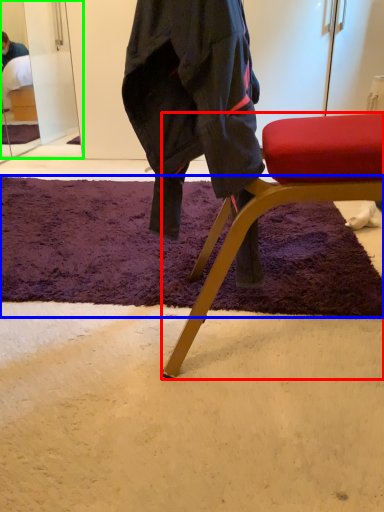
Question: Considering the real-world distances, which object is closest to chair (highlighted by a red box)? mat (highlighted by a blue box) or mirror (highlighted by a green box).

Choices:
 (A) mat
 (B) mirror

Answer: (A)